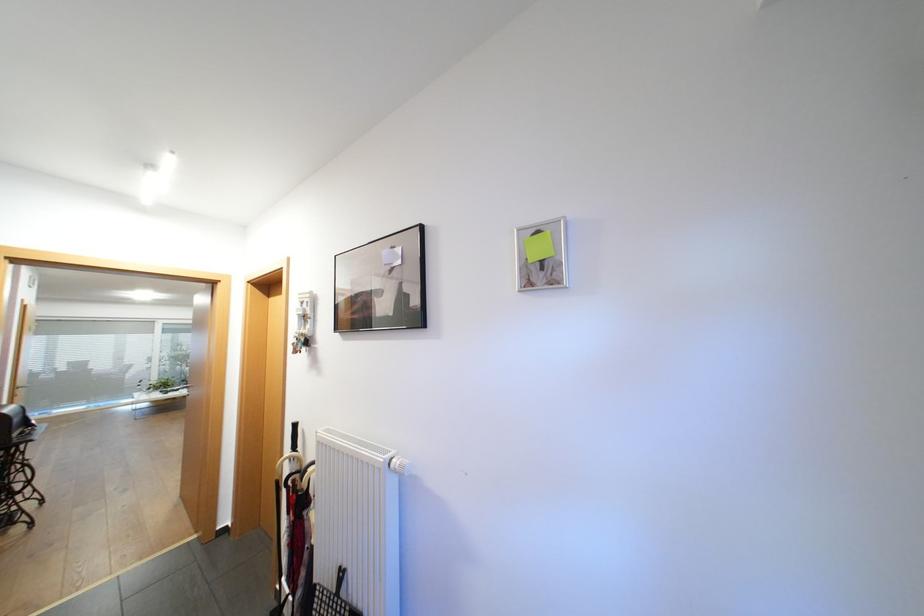
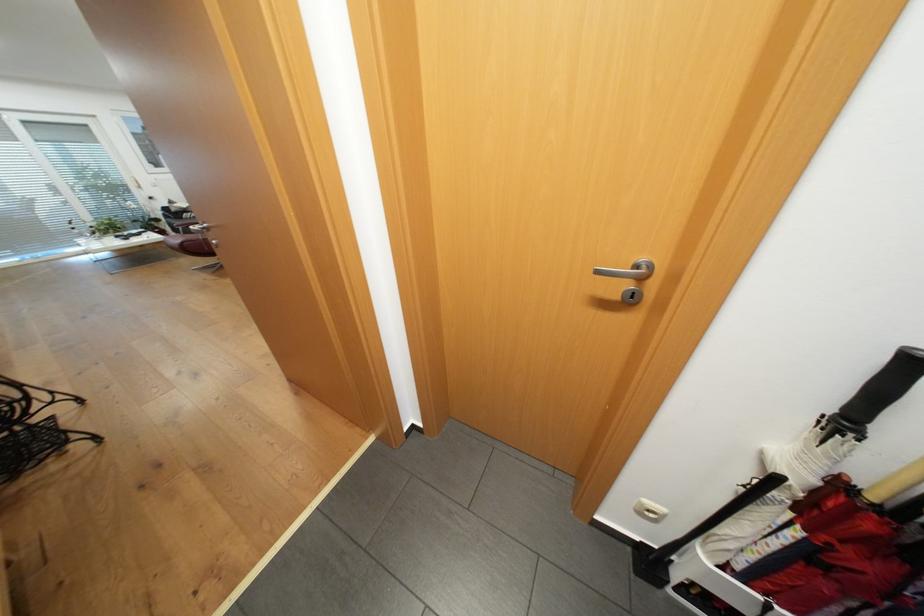
Where in the second image is the point corresponding to (x=40, y=523) from the first image?

(102, 438)